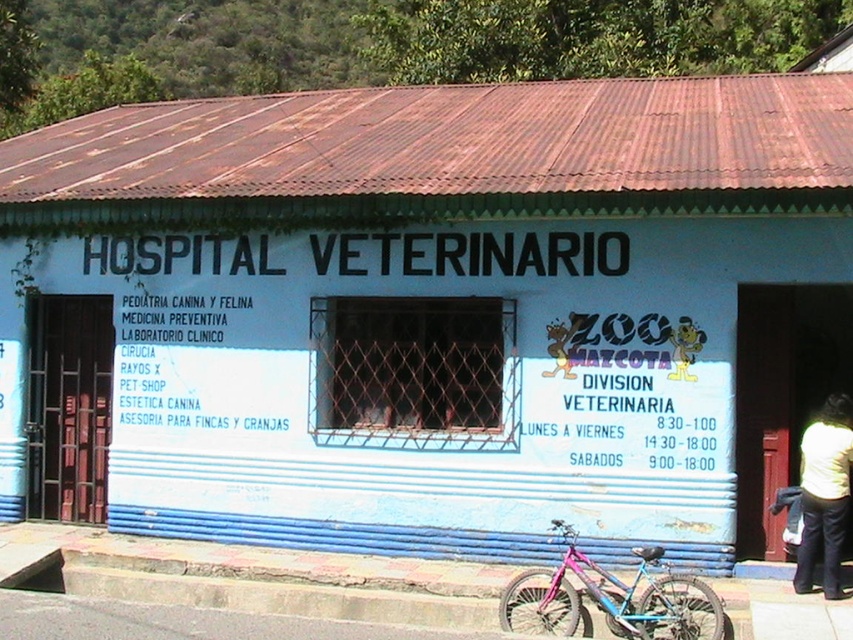
Is pink metallic bicycle at lower center shorter than light yellow sweater at lower right?

Yes.

Between point (645, 572) and point (820, 444), which one is positioned in front?

Point (645, 572)

Does point (627, 628) lie behind point (846, 436)?

No, (627, 628) is in front of (846, 436).

Locate an element on the screen. Image resolution: width=853 pixels, height=640 pixels. pink metallic bicycle at lower center is located at coordinates (610, 596).